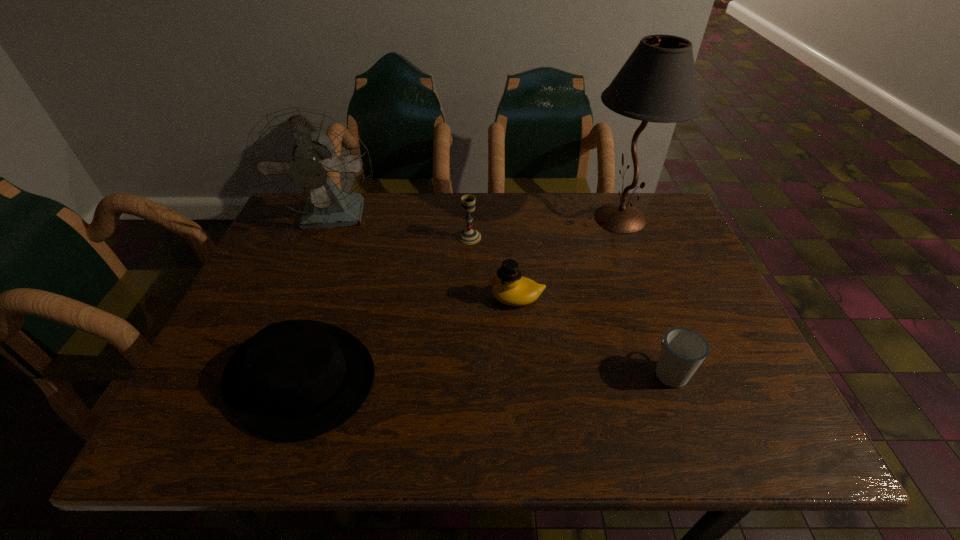
Locate an element on the screen. The height and width of the screenshot is (540, 960). table lamp is located at coordinates (658, 83).

At what (x,y) coordinates should I click in order to perform the action: click on the second tallest object. Please return your answer as a coordinate pair (x, y). The width and height of the screenshot is (960, 540). Looking at the image, I should click on (307, 160).

The width and height of the screenshot is (960, 540). What are the coordinates of `chalice` in the screenshot? It's located at (468, 236).

I want to click on the third object from right to left, so click(x=509, y=286).

Where is `the third nearest object`? This screenshot has width=960, height=540. the third nearest object is located at coordinates (509, 286).

Where is `cup`? cup is located at coordinates (683, 350).

Identify the location of fedora. (295, 379).

Where is `vacant area located 0.230m on the front-facing side of the table lamp`? vacant area located 0.230m on the front-facing side of the table lamp is located at coordinates (501, 218).

Where is `vacant space located 0.250m on the front-facing side of the table lamp`? vacant space located 0.250m on the front-facing side of the table lamp is located at coordinates (494, 218).

Locate an element on the screen. The height and width of the screenshot is (540, 960). free region located 0.180m on the front-facing side of the table lamp is located at coordinates (518, 218).